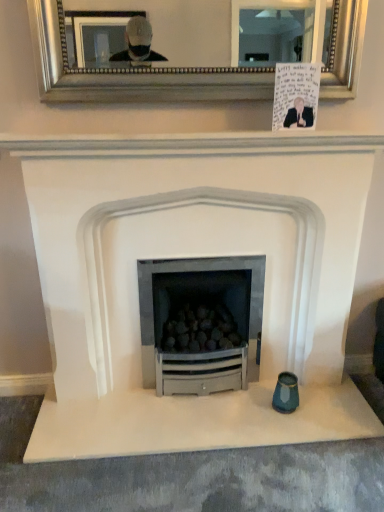
Identify the location of free spot to the right of handwritten paper at upper center. The image size is (384, 512). (332, 137).